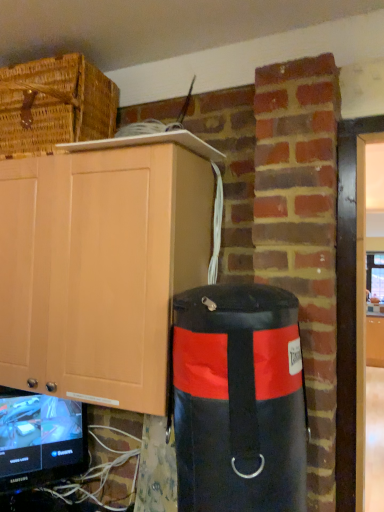
Question: Would you consider black leather punching bag at right to be distant from matte wood cabinet at center, the second cabinetry from the left?

Choices:
 (A) no
 (B) yes

Answer: (A)

Question: Does black leather punching bag at right have a greater width compared to matte wood cabinet at center, arranged as the second cabinetry when viewed from the front?

Choices:
 (A) yes
 (B) no

Answer: (B)

Question: Can you see black leather punching bag at right touching matte wood cabinet at center, acting as the 1th cabinetry starting from the right?

Choices:
 (A) no
 (B) yes

Answer: (A)

Question: Considering the relative positions of black leather punching bag at right and matte wood cabinet at center, acting as the 1th cabinetry starting from the right, in the image provided, is black leather punching bag at right to the right of matte wood cabinet at center, acting as the 1th cabinetry starting from the right, from the viewer's perspective?

Choices:
 (A) no
 (B) yes

Answer: (A)

Question: Is matte wood cabinet at center, arranged as the second cabinetry when viewed from the top, located within black leather punching bag at right?

Choices:
 (A) yes
 (B) no

Answer: (B)

Question: From a real-world perspective, is black leather punching bag at right physically below matte wood cabinet at center, arranged as the second cabinetry when viewed from the top?

Choices:
 (A) yes
 (B) no

Answer: (B)

Question: Does black leather punching bag at right appear on the right side of matte wood cabinet at upper left, which ranks as the second cabinetry in right-to-left order?

Choices:
 (A) no
 (B) yes

Answer: (B)

Question: Is black leather punching bag at right outside of matte wood cabinet at upper left, which ranks as the first cabinetry in top-to-bottom order?

Choices:
 (A) yes
 (B) no

Answer: (A)

Question: Considering the relative sizes of black leather punching bag at right and matte wood cabinet at upper left, which ranks as the second cabinetry in right-to-left order, in the image provided, is black leather punching bag at right thinner than matte wood cabinet at upper left, which ranks as the second cabinetry in right-to-left order,?

Choices:
 (A) yes
 (B) no

Answer: (A)

Question: From the image's perspective, does black leather punching bag at right appear lower than matte wood cabinet at upper left, which is the 1th cabinetry in left-to-right order?

Choices:
 (A) yes
 (B) no

Answer: (A)

Question: Is black leather punching bag at right next to matte wood cabinet at upper left, which is the 1th cabinetry in left-to-right order, and touching it?

Choices:
 (A) yes
 (B) no

Answer: (B)

Question: Considering the relative positions of black leather punching bag at right and matte wood cabinet at upper left, which ranks as the first cabinetry in top-to-bottom order, in the image provided, is black leather punching bag at right to the left of matte wood cabinet at upper left, which ranks as the first cabinetry in top-to-bottom order, from the viewer's perspective?

Choices:
 (A) no
 (B) yes

Answer: (A)

Question: Is matte wood cabinet at upper left, arranged as the 2th cabinetry when ordered from the bottom, positioned beyond the bounds of black glossy television at lower left?

Choices:
 (A) no
 (B) yes

Answer: (B)